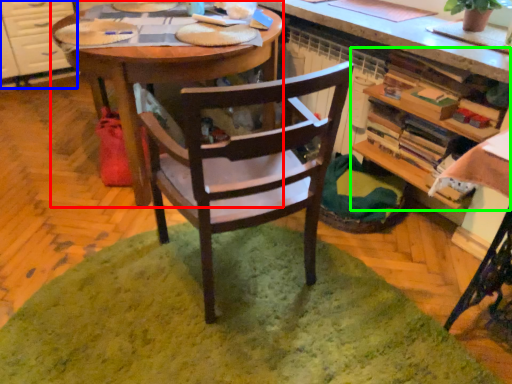
Question: Which object is positioned closest to desk (highlighted by a red box)? Select from cabinetry (highlighted by a blue box) and shelf (highlighted by a green box).

Choices:
 (A) cabinetry
 (B) shelf

Answer: (B)